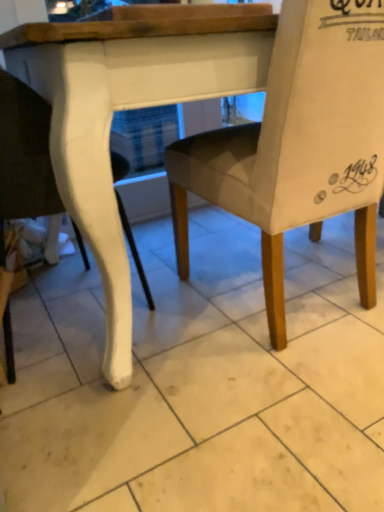
Locate an element on the screen. The image size is (384, 512). vacant space in white glossy chair leg at left, which ranks as the 1th chair in left-to-right order (from a real-world perspective) is located at coordinates (59, 334).